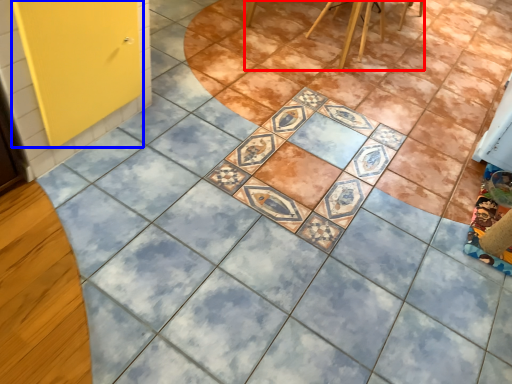
Question: Which object appears farthest to the camera in this image, furniture (highlighted by a red box) or screen door (highlighted by a blue box)?

Choices:
 (A) furniture
 (B) screen door

Answer: (A)